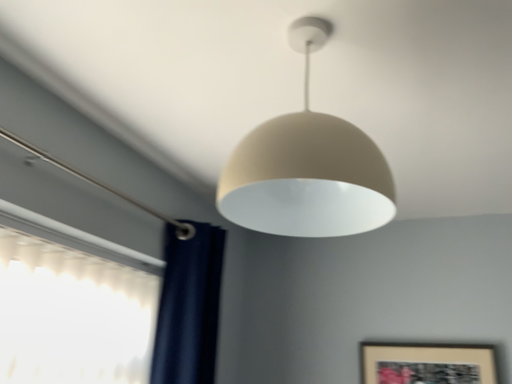
What do you see at coordinates (307, 168) in the screenshot?
I see `matte beige lampshade at center` at bounding box center [307, 168].

At what (x,y) coordinates should I click in order to perform the action: click on matte beige lampshade at center. Please return your answer as a coordinate pair (x, y). The height and width of the screenshot is (384, 512). Looking at the image, I should click on (307, 168).

Identify the location of wooden framed artwork at lower right. This screenshot has width=512, height=384. (426, 363).

Describe the element at coordinates (426, 363) in the screenshot. I see `wooden framed artwork at lower right` at that location.

Where is `matte beige lampshade at center`? The height and width of the screenshot is (384, 512). matte beige lampshade at center is located at coordinates (307, 168).

Is wooden framed artwork at lower right to the left of matte beige lampshade at center from the viewer's perspective?

No, wooden framed artwork at lower right is not to the left of matte beige lampshade at center.

Considering the positions of objects wooden framed artwork at lower right and matte beige lampshade at center in the image provided, who is behind, wooden framed artwork at lower right or matte beige lampshade at center?

wooden framed artwork at lower right is behind.

Considering the points (403, 363) and (337, 175), which point is in front, point (403, 363) or point (337, 175)?

The point (337, 175) is closer.

From the image's perspective, would you say wooden framed artwork at lower right is positioned over matte beige lampshade at center?

Incorrect, from the image's perspective, wooden framed artwork at lower right is lower than matte beige lampshade at center.

From a real-world perspective, between wooden framed artwork at lower right and matte beige lampshade at center, who is vertically higher?

matte beige lampshade at center is physically above.

Which of these two, wooden framed artwork at lower right or matte beige lampshade at center, is thinner?

wooden framed artwork at lower right is thinner.

From their relative heights in the image, would you say wooden framed artwork at lower right is taller or shorter than matte beige lampshade at center?

Considering their sizes, wooden framed artwork at lower right has less height than matte beige lampshade at center.

In the scene shown: Does wooden framed artwork at lower right have a smaller size compared to matte beige lampshade at center?

Yes, wooden framed artwork at lower right is smaller than matte beige lampshade at center.

Is matte beige lampshade at center completely or partially inside wooden framed artwork at lower right?

No.

Does wooden framed artwork at lower right touch matte beige lampshade at center?

No, wooden framed artwork at lower right is not touching matte beige lampshade at center.

Is wooden framed artwork at lower right oriented away from matte beige lampshade at center?

No.

You are a GUI agent. You are given a task and a screenshot of the screen. Output one action in this format:
    pyautogui.click(x=<x>, y=<y>)
    Task: Click on the picture frame that appears below the matte beige lampshade at center (from the image's perspective)
    
    Given the screenshot: What is the action you would take?
    pyautogui.click(x=426, y=363)

Considering the relative positions of matte beige lampshade at center and wooden framed artwork at lower right in the image provided, is matte beige lampshade at center to the left of wooden framed artwork at lower right from the viewer's perspective?

Yes, matte beige lampshade at center is to the left of wooden framed artwork at lower right.

Which object is further away from the camera, matte beige lampshade at center or wooden framed artwork at lower right?

wooden framed artwork at lower right is further from the camera.

Is point (307, 159) positioned before point (451, 383)?

Yes, point (307, 159) is closer to viewer.

From the image's perspective, relative to wooden framed artwork at lower right, is matte beige lampshade at center above or below?

Based on their image positions, matte beige lampshade at center is located above wooden framed artwork at lower right.

From a real-world perspective, is matte beige lampshade at center above or below wooden framed artwork at lower right?

In terms of real-world spatial position, matte beige lampshade at center is above wooden framed artwork at lower right.

Which object is thinner, matte beige lampshade at center or wooden framed artwork at lower right?

wooden framed artwork at lower right is thinner.

Is matte beige lampshade at center taller than wooden framed artwork at lower right?

Correct, matte beige lampshade at center is much taller as wooden framed artwork at lower right.

Which of these two, matte beige lampshade at center or wooden framed artwork at lower right, is bigger?

matte beige lampshade at center is bigger.

Is matte beige lampshade at center inside or outside of wooden framed artwork at lower right?

matte beige lampshade at center cannot be found inside wooden framed artwork at lower right.

Is matte beige lampshade at center next to wooden framed artwork at lower right and touching it?

matte beige lampshade at center and wooden framed artwork at lower right are not in contact.

Is matte beige lampshade at center oriented towards wooden framed artwork at lower right?

No, matte beige lampshade at center does not turn towards wooden framed artwork at lower right.

What's the angular difference between matte beige lampshade at center and wooden framed artwork at lower right's facing directions?

There is a 90.7-degree angle between the facing directions of matte beige lampshade at center and wooden framed artwork at lower right.

Where is `picture frame below the matte beige lampshade at center (from the image's perspective)`? This screenshot has width=512, height=384. picture frame below the matte beige lampshade at center (from the image's perspective) is located at coordinates (426, 363).

At what (x,y) coordinates should I click in order to perform the action: click on picture frame behind the matte beige lampshade at center. Please return your answer as a coordinate pair (x, y). Looking at the image, I should click on (426, 363).

At what (x,y) coordinates should I click in order to perform the action: click on picture frame directly beneath the matte beige lampshade at center (from a real-world perspective). Please return your answer as a coordinate pair (x, y). Looking at the image, I should click on (426, 363).